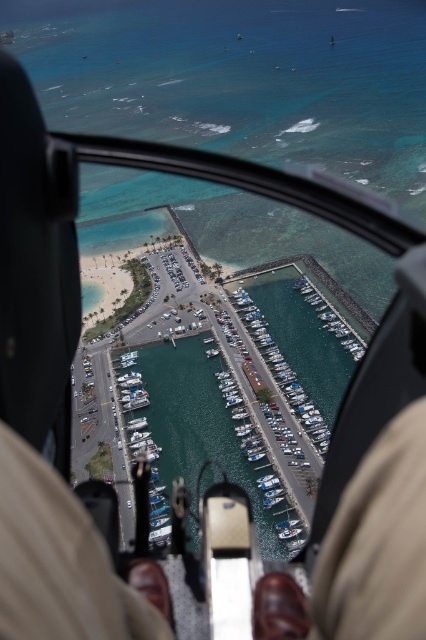
You are a pilot in a helicopter and need to land it on a helipad located behind the white plastic boats at center. The helipad is 150 meters away from the camera. Can you safely land the helicopter there?

The white plastic boats at center is 156.40 meters from camera, so the helipad behind it would be further than 150 meters away. Therefore, you cannot safely land the helicopter there as it exceeds the required distance.

From the picture: You are a passenger in the helicopter and want to check if your brown leather shoes at lower center are positioned directly in front of the cockpit controls. Based on the coordinates provided, can you confirm their placement?

The brown leather shoes at lower center are located at point (x=57, y=561), which places them in the lower center area of the image, likely positioned in front of the cockpit controls as described.

You are a passenger in the helicopter and want to see the white plastic boats at center clearly. However, your brown leather shoes at lower center are blocking your view. Can you move your feet to the left or right to get a better view?

The brown leather shoes at lower center are in front of the white plastic boats at center. Moving your feet either to the left or right would shift their position, potentially allowing you to see the white plastic boats at center more clearly.